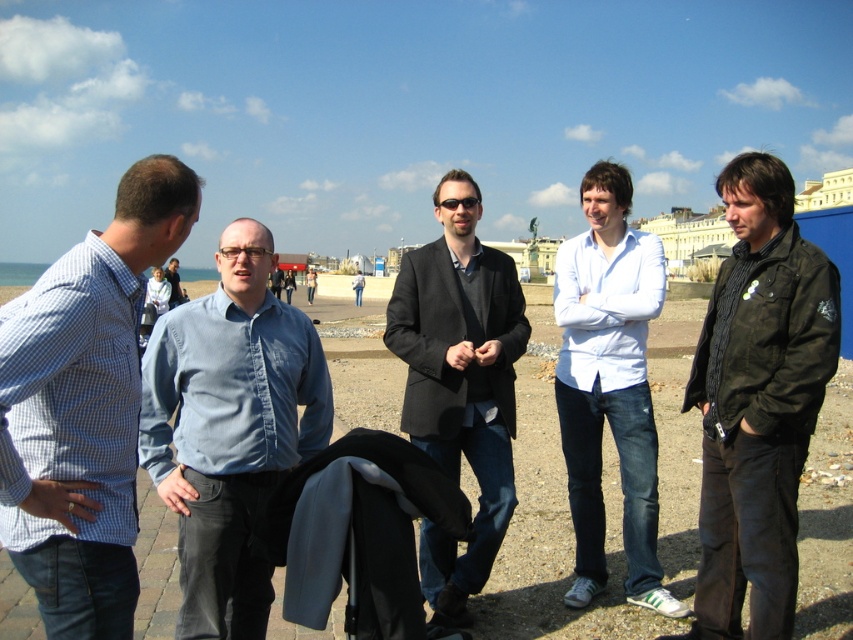
Which is in front, point (143, 392) or point (564, 436)?

Positioned in front is point (143, 392).

Which of these two, blue denim shirt at center or white matte shirt at center, stands taller?

white matte shirt at center is taller.

Find the location of `blue denim shirt at center`. blue denim shirt at center is located at coordinates (230, 429).

How much distance is there between checkered fabric shirt at left and matte black jacket at center?

77.33 feet

Does checkered fabric shirt at left come in front of matte black jacket at center?

That is True.

Locate an element on the screen. checkered fabric shirt at left is located at coordinates (84, 406).

Can you confirm if blue denim shirt at center is positioned below matte black jacket at center?

Correct, blue denim shirt at center is located below matte black jacket at center.

Is point (279, 392) positioned in front of point (415, 403)?

Yes, it is in front of point (415, 403).

Find the location of a particular element. blue denim shirt at center is located at coordinates (230, 429).